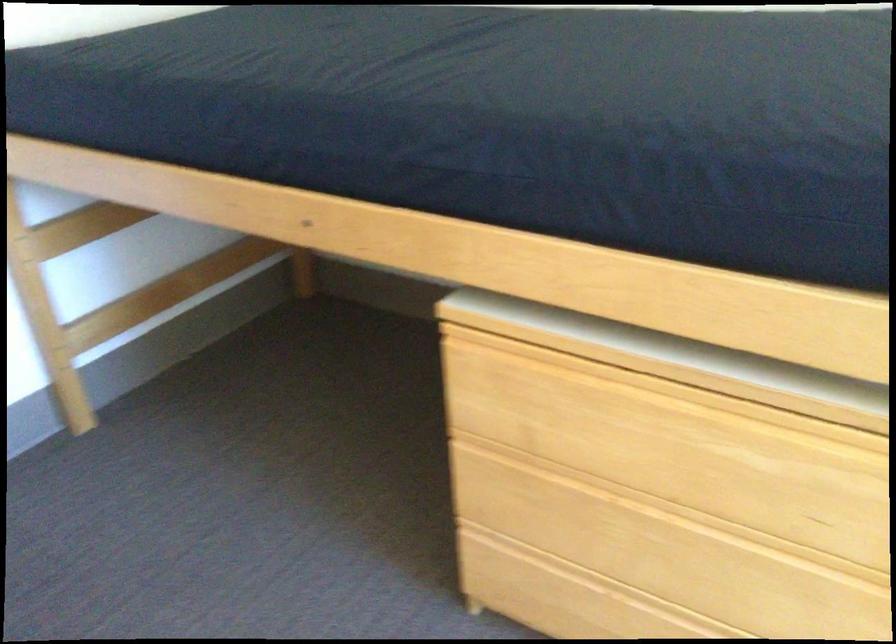
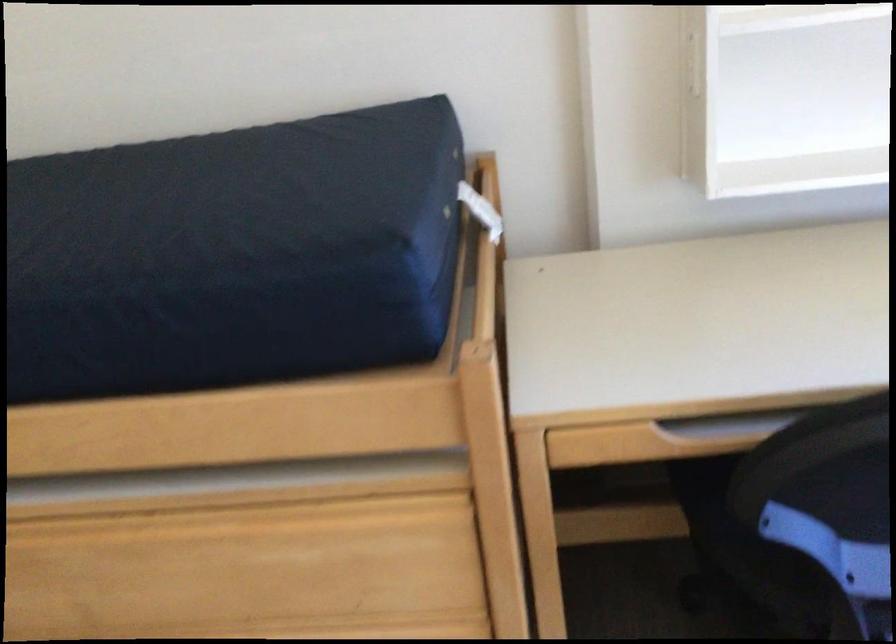
In the second image, find the point that corresponds to point 787,93 in the first image.

(243, 221)